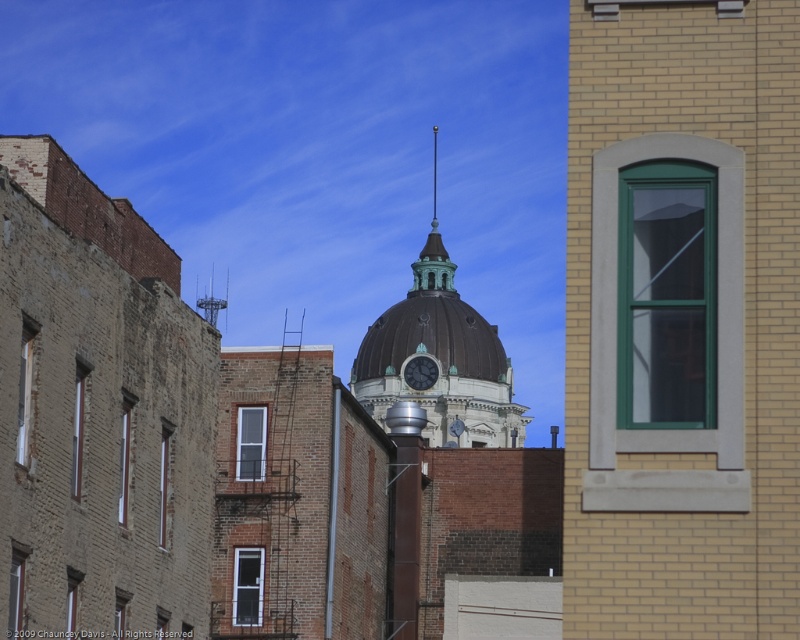
Question: Among these points, which one is farthest from the camera?

Choices:
 (A) (416, 355)
 (B) (472, 429)
 (C) (414, 266)

Answer: (C)

Question: Considering the relative positions of brown dome at center and metallic spire at upper center in the image provided, where is brown dome at center located with respect to metallic spire at upper center?

Choices:
 (A) left
 (B) right

Answer: (B)

Question: Which point is closer to the camera?

Choices:
 (A) (440, 264)
 (B) (468, 353)

Answer: (B)

Question: Which object appears closest to the camera in this image?

Choices:
 (A) green patina spire at center
 (B) matte black clock at center
 (C) metallic spire at upper center

Answer: (B)

Question: Can you confirm if brown dome at center is wider than matte black clock at center?

Choices:
 (A) yes
 (B) no

Answer: (A)

Question: Is brown dome at center positioned in front of green patina spire at center?

Choices:
 (A) no
 (B) yes

Answer: (B)